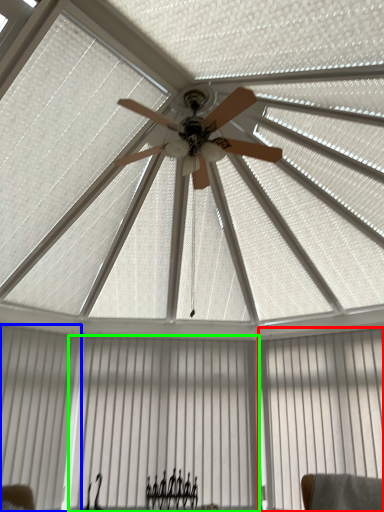
Question: Which is farther away from curtain (highlighted by a red box)? shutter (highlighted by a blue box) or curtain (highlighted by a green box)?

Choices:
 (A) shutter
 (B) curtain

Answer: (A)